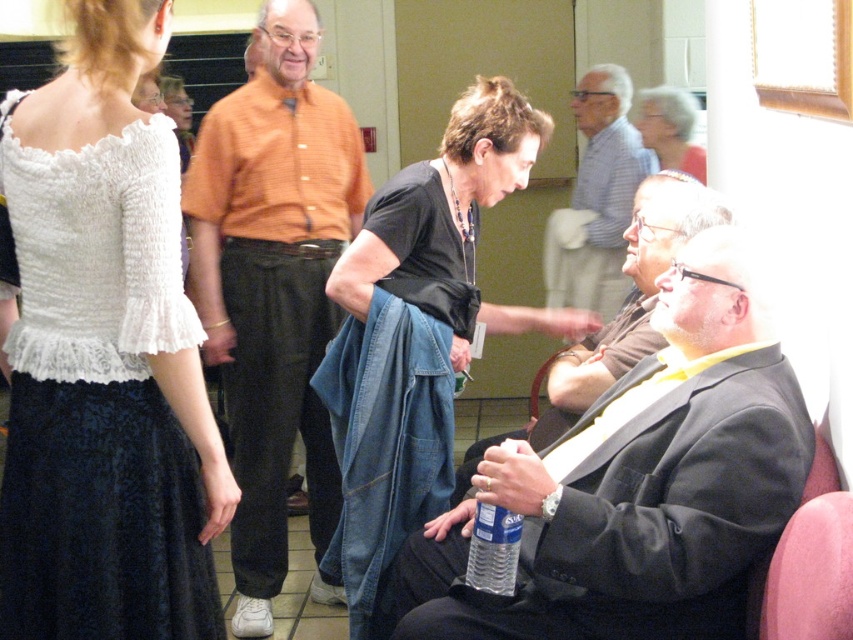
You are at a social gathering and want to approach the white lace dress at upper left and the black suit jacket at lower right. Which one is on the right side when facing the scene?

The black suit jacket at lower right is positioned on the right side of the white lace dress at upper left.

You are organizing a charity event and need to arrange participants by height for a photo. You have two people in the scene wearing the black jersey at center and the gray striped shirt at upper center. Based on their positions in the image, which participant should stand in front to ensure visibility?

The black jersey at center is taller than the gray striped shirt at upper center, so the gray striped shirt at upper center should stand in front to ensure visibility.

In the scene of a social gathering, there is a point marked at coordinates (640, 481). What object is located at this point?

The point at coordinates (640, 481) marks the location of the black suit jacket at lower right.